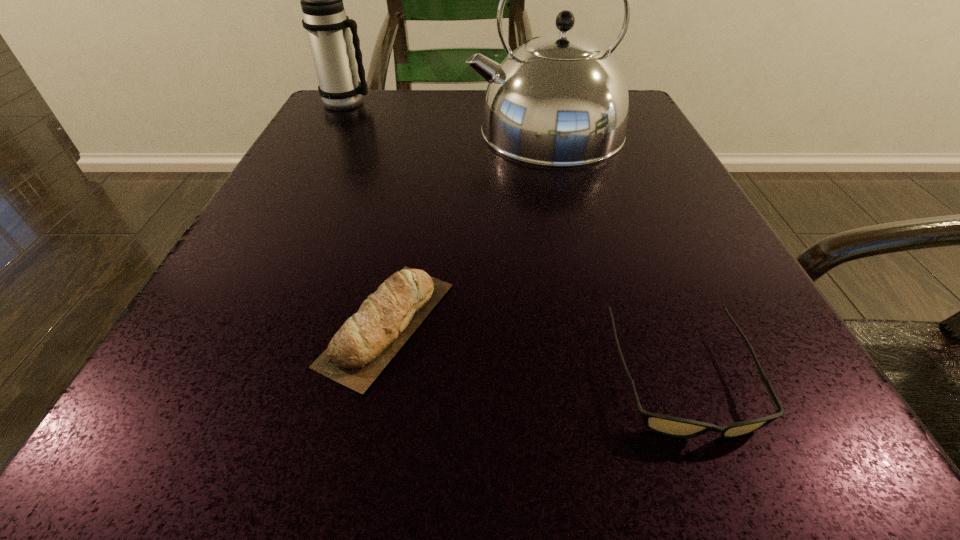
The height and width of the screenshot is (540, 960). Identify the location of vacant space at the near edge of the desktop. (549, 422).

In the image, there is a desktop. Identify the location of vacant space at the left edge. The width and height of the screenshot is (960, 540). (386, 151).

Find the location of a particular element. The image size is (960, 540). vacant space at the right edge of the desktop is located at coordinates (632, 288).

At what (x,y) coordinates should I click in order to perform the action: click on vacant space at the far left corner. Please return your answer as a coordinate pair (x, y). This screenshot has width=960, height=540. Looking at the image, I should click on (403, 97).

You are a GUI agent. You are given a task and a screenshot of the screen. Output one action in this format:
    pyautogui.click(x=<x>, y=<y>)
    Task: Click on the vacant space at the near left corner of the desktop
    Image resolution: width=960 pixels, height=540 pixels.
    Given the screenshot: What is the action you would take?
    pyautogui.click(x=174, y=429)

This screenshot has width=960, height=540. In order to click on free space between the sunglasses and the tallest object in this screenshot , I will do `click(613, 254)`.

The width and height of the screenshot is (960, 540). I want to click on free spot between the thermos bottle and the sunglasses, so click(514, 240).

Where is `vacant space that is in between the third shortest object and the tallest object`? This screenshot has width=960, height=540. vacant space that is in between the third shortest object and the tallest object is located at coordinates tap(445, 117).

This screenshot has height=540, width=960. Find the location of `unoccupied area between the second object from left to right and the thermos bottle`. unoccupied area between the second object from left to right and the thermos bottle is located at coordinates (367, 213).

This screenshot has width=960, height=540. I want to click on free spot between the sunglasses and the leftmost object, so click(x=514, y=240).